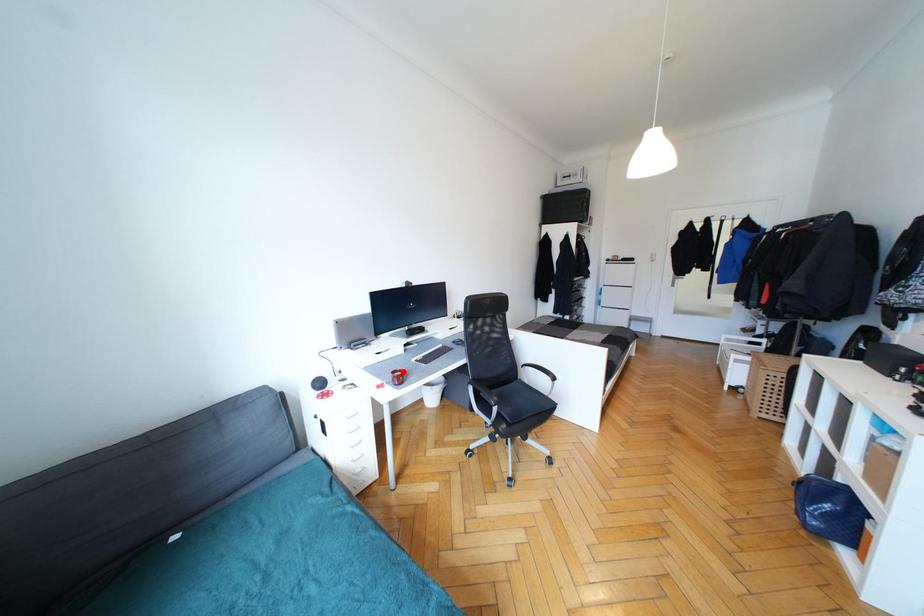
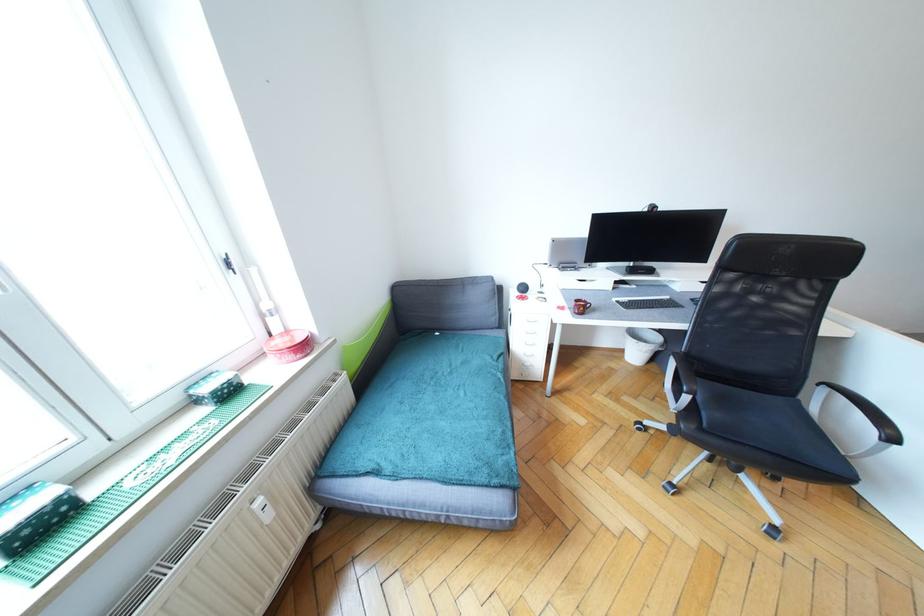
Locate, in the second image, the point that corresponds to the highlighted location in the first image.

(589, 302)